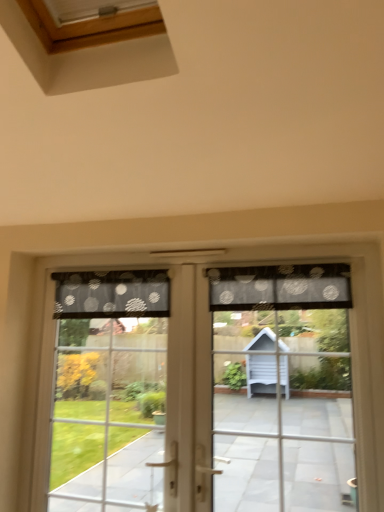
The width and height of the screenshot is (384, 512). What are the coordinates of `free location above translucent fabric curtain at left (from a real-world perspective)` in the screenshot? It's located at (110, 264).